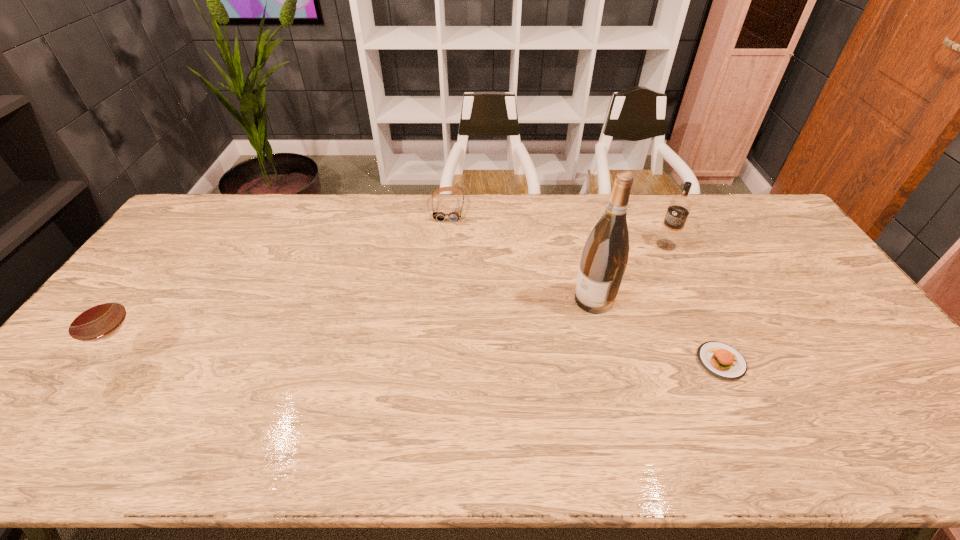
The width and height of the screenshot is (960, 540). Find the location of `the third shortest object`. the third shortest object is located at coordinates (96, 316).

At what (x,y) coordinates should I click in order to perform the action: click on wineglass. Please return your answer as a coordinate pair (x, y). Looking at the image, I should click on (96, 316).

The image size is (960, 540). What are the coordinates of `food` in the screenshot? It's located at (720, 359).

Find the location of `the third object from left to right`. the third object from left to right is located at coordinates (604, 258).

You are a GUI agent. You are given a task and a screenshot of the screen. Output one action in this format:
    pyautogui.click(x=<x>, y=<y>)
    Task: Click on the third farthest object
    The width and height of the screenshot is (960, 540).
    Given the screenshot: What is the action you would take?
    pyautogui.click(x=604, y=258)

This screenshot has height=540, width=960. I want to click on the fourth tallest object, so click(455, 214).

Where is `goggles`? goggles is located at coordinates (455, 214).

Find the location of a particular element. the fourth nearest object is located at coordinates (679, 208).

You are a GUI agent. You are given a task and a screenshot of the screen. Output one action in this format:
    pyautogui.click(x=<x>, y=<y>)
    Task: Click on the vodka
    
    Given the screenshot: What is the action you would take?
    pyautogui.click(x=679, y=208)

At what (x,y) coordinates should I click in order to perform the action: click on vacant point located on the back of the leftmost object. Please return your answer as a coordinate pair (x, y). Image resolution: width=960 pixels, height=540 pixels. Looking at the image, I should click on (208, 252).